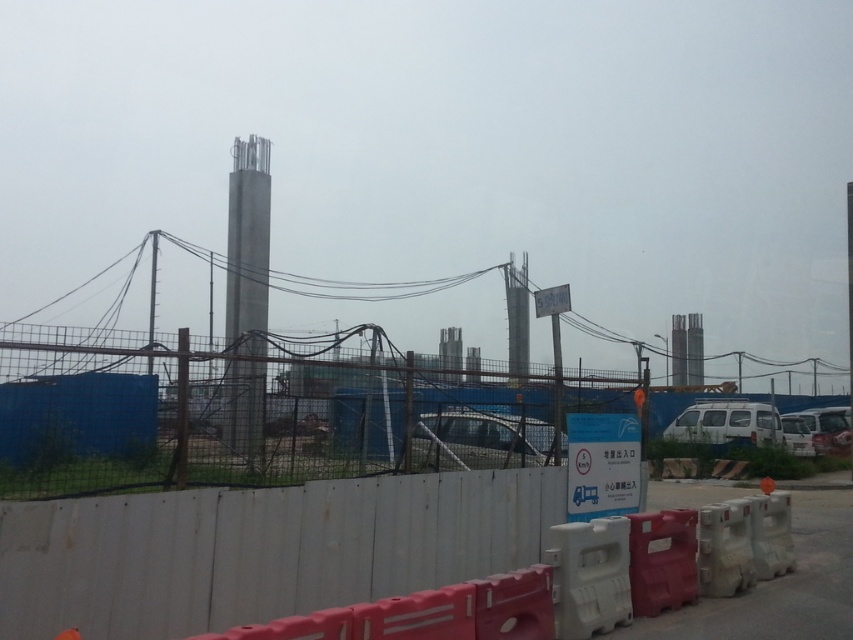
Question: Which of the following is the farthest from the observer?

Choices:
 (A) (509, 429)
 (B) (178, 385)

Answer: (A)

Question: Does blue mesh fence at lower left appear under silver metallic car at center?

Choices:
 (A) no
 (B) yes

Answer: (B)

Question: Which object is closer to the camera taking this photo?

Choices:
 (A) silver metallic car at center
 (B) blue mesh fence at lower left

Answer: (B)

Question: Does blue mesh fence at lower left have a larger size compared to silver metallic car at center?

Choices:
 (A) yes
 (B) no

Answer: (A)

Question: Can you confirm if blue mesh fence at lower left is wider than silver metallic car at center?

Choices:
 (A) yes
 (B) no

Answer: (A)